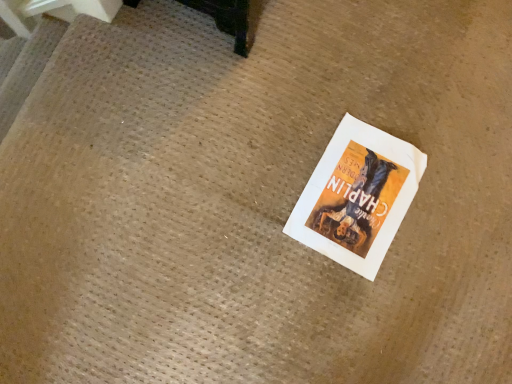
This screenshot has height=384, width=512. What do you see at coordinates (357, 196) in the screenshot?
I see `white paper poster at center` at bounding box center [357, 196].

You are a GUI agent. You are given a task and a screenshot of the screen. Output one action in this format:
    pyautogui.click(x=<x>, y=<y>)
    Task: Click on the white paper poster at center
    The width and height of the screenshot is (512, 384).
    Given the screenshot: What is the action you would take?
    pyautogui.click(x=357, y=196)

The width and height of the screenshot is (512, 384). I want to click on white paper poster at center, so click(x=357, y=196).